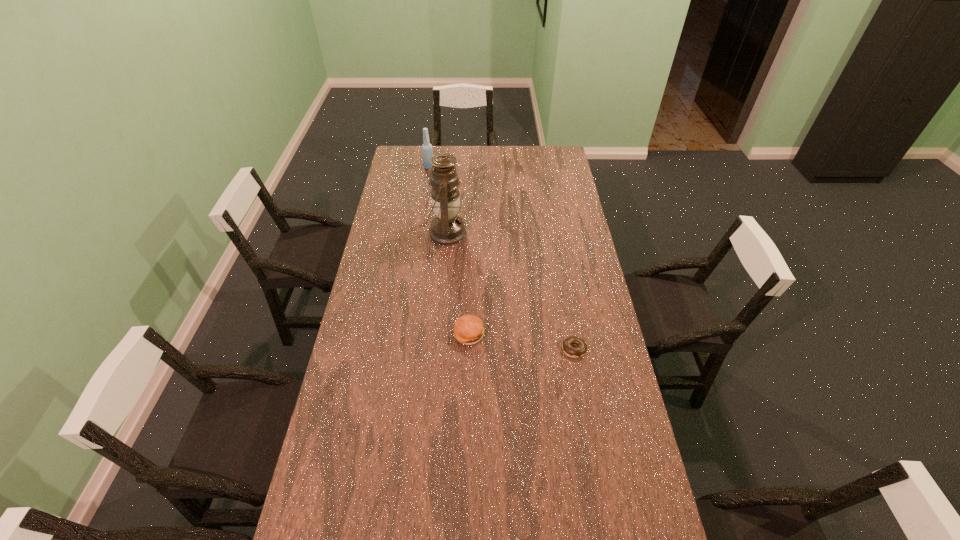
Locate an element on the screen. vacant region that satisfies the following two spatial constraints: 1. on the front side of the bottle; 2. on the right side of the second farthest object is located at coordinates (419, 233).